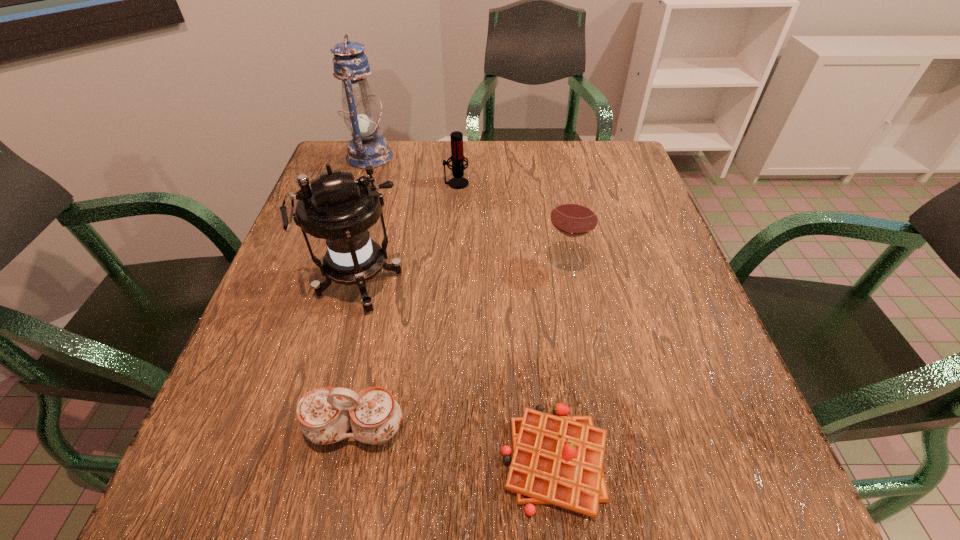
The height and width of the screenshot is (540, 960). Find the location of `vacant region located on the right of the fourth object from left to right`. vacant region located on the right of the fourth object from left to right is located at coordinates (593, 183).

Locate an element on the screen. vacant space located 0.380m on the back of the waffle is located at coordinates (531, 257).

Find the location of `lantern present at the far edge`. lantern present at the far edge is located at coordinates (366, 148).

The width and height of the screenshot is (960, 540). Identify the location of microphone that is at the far edge. (458, 182).

This screenshot has height=540, width=960. In order to click on object present at the near edge in this screenshot , I will do `click(558, 460)`.

Where is `object at the far left corner`? This screenshot has height=540, width=960. object at the far left corner is located at coordinates (366, 148).

Locate an element on the screen. free region at the far edge is located at coordinates (570, 150).

At what (x,y) coordinates should I click in order to perform the action: click on vacant space at the near edge of the desktop. Please return your answer as a coordinate pair (x, y). Looking at the image, I should click on (608, 480).

Find the location of a particular element. This screenshot has width=960, height=540. vacant point at the left edge is located at coordinates (226, 407).

In the image, there is a desktop. Identify the location of vacant space at the right edge. (710, 411).